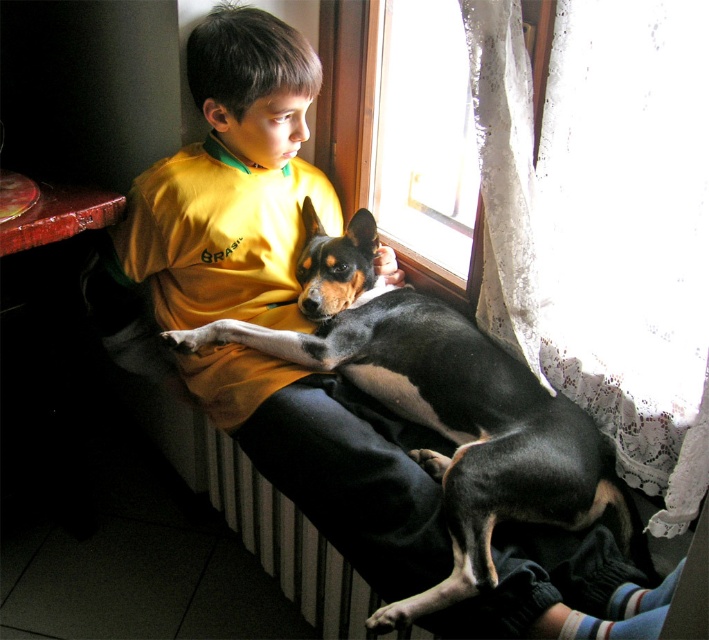
Question: Which of the following is the closest to the observer?

Choices:
 (A) (233, 333)
 (B) (391, 212)

Answer: (A)

Question: Can you confirm if black smooth dog at center is positioned to the right of transparent glass window at upper center?

Choices:
 (A) yes
 (B) no

Answer: (B)

Question: Which point is closer to the camera?

Choices:
 (A) (452, 256)
 (B) (459, 324)

Answer: (B)

Question: Can you confirm if black smooth dog at center is bigger than transparent glass window at upper center?

Choices:
 (A) no
 (B) yes

Answer: (B)

Question: Does black smooth dog at center come behind transparent glass window at upper center?

Choices:
 (A) no
 (B) yes

Answer: (A)